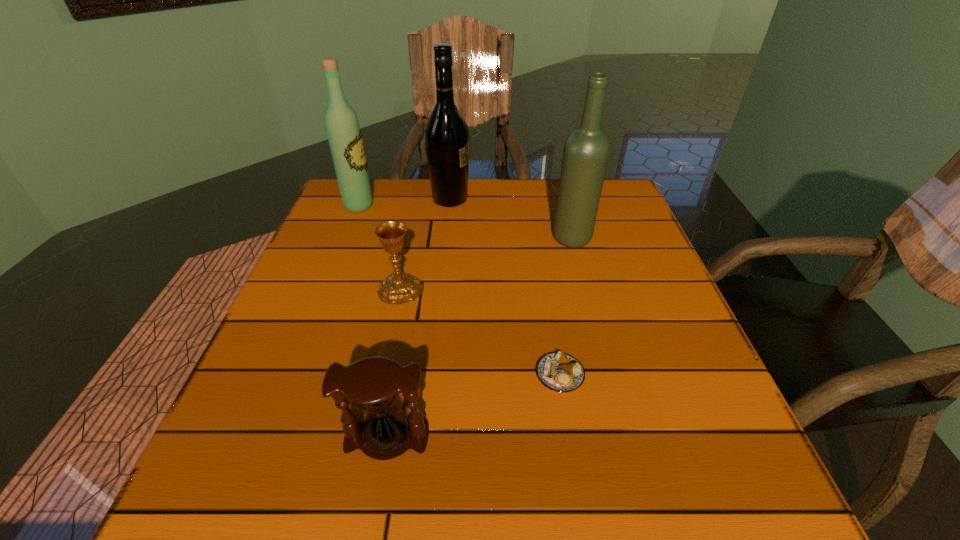
Find the location of `vacant area that satisfies the following two spatial constraints: 1. on the label of the second wine bottle from right to left; 2. on the left side of the shortest object`. vacant area that satisfies the following two spatial constraints: 1. on the label of the second wine bottle from right to left; 2. on the left side of the shortest object is located at coordinates (433, 375).

Image resolution: width=960 pixels, height=540 pixels. In order to click on free space that satisfies the following two spatial constraints: 1. on the back side of the rightmost wine bottle; 2. on the front-facing side of the leftmost object in this screenshot , I will do `click(564, 205)`.